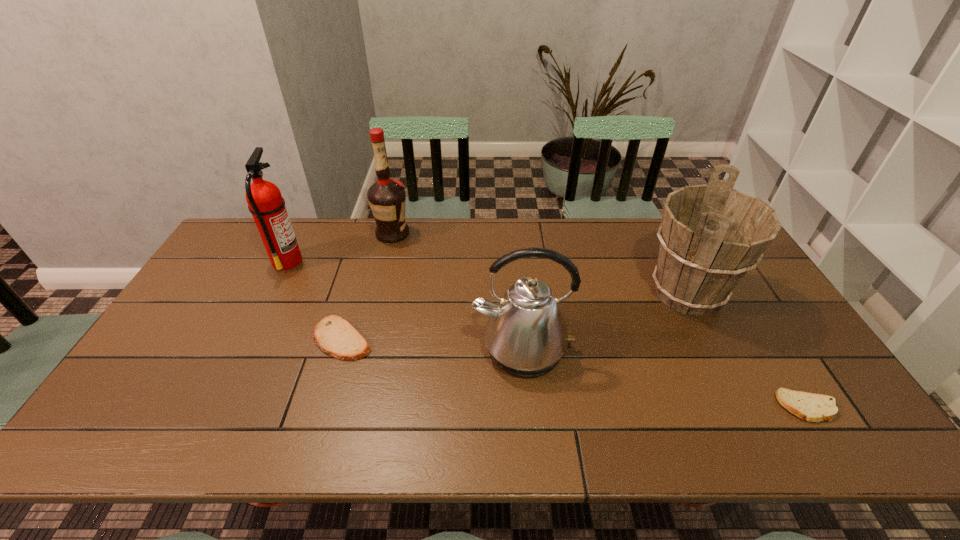
In order to click on liquor in this screenshot , I will do `click(387, 198)`.

Find the location of a particular element. This screenshot has height=540, width=960. fire extinguisher is located at coordinates (265, 202).

Identify the location of bucket. (711, 235).

You are a GUI agent. You are given a task and a screenshot of the screen. Output one action in this format:
    pyautogui.click(x=<x>, y=<y>)
    Task: Click on the kettle
    
    Given the screenshot: What is the action you would take?
    pyautogui.click(x=526, y=336)

In order to click on the taller pita bread in this screenshot , I will do `click(334, 335)`.

Identify the location of the farther pita bread. This screenshot has height=540, width=960. (334, 335).

This screenshot has width=960, height=540. I want to click on the shorter pita bread, so click(x=812, y=407).

Identify the location of the nearest object. The image size is (960, 540). (812, 407).

This screenshot has height=540, width=960. Identify the location of free space located on the front and back of the farthest object. (465, 234).

I want to click on vacant space located 0.220m on the side of the fire extinguisher near the handle, so click(x=370, y=261).